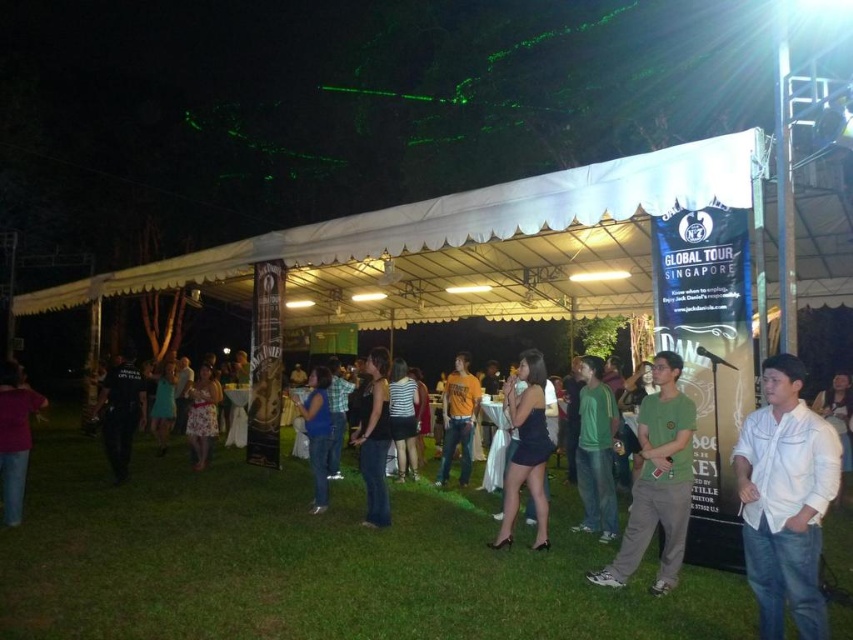
Who is more forward, (445,403) or (317,492)?

Positioned in front is point (317,492).

Does orange cotton shirt at center appear on the left side of matte blue dress at center?

In fact, orange cotton shirt at center is to the right of matte blue dress at center.

In order to click on orange cotton shirt at center in this screenshot , I will do 457,419.

I want to click on satin black dress at center, so click(526, 449).

Does point (497, 532) come closer to viewer compared to point (593, 506)?

Yes, it is.

Find the location of a particular element. The height and width of the screenshot is (640, 853). satin black dress at center is located at coordinates (526, 449).

Does point (511, 496) lie in front of point (158, 401)?

Yes, it is in front of point (158, 401).

Can you confirm if satin black dress at center is positioned above light blue dress at center?

Indeed, satin black dress at center is positioned over light blue dress at center.

Is point (509, 486) behind point (154, 396)?

No, (509, 486) is in front of (154, 396).

Where is `satin black dress at center`? The width and height of the screenshot is (853, 640). satin black dress at center is located at coordinates pyautogui.click(x=526, y=449).